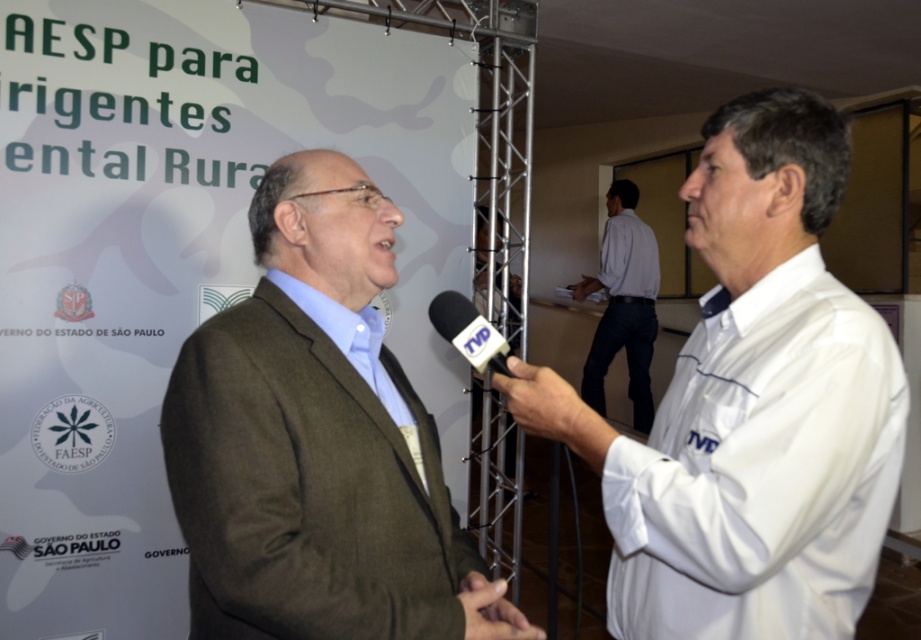
Question: Which object is the farthest from the white shirt at center?

Choices:
 (A) matte brown suit at center
 (B) black plastic microphone at center
 (C) white glossy shirt at center

Answer: (A)

Question: Can you confirm if matte brown suit at center is thinner than black plastic microphone at center?

Choices:
 (A) no
 (B) yes

Answer: (A)

Question: Which point is closer to the camera?

Choices:
 (A) (646, 358)
 (B) (366, 413)

Answer: (B)

Question: Is matte brown suit at center positioned before black plastic microphone at center?

Choices:
 (A) no
 (B) yes

Answer: (B)

Question: Does white glossy shirt at center appear on the right side of white shirt at center?

Choices:
 (A) yes
 (B) no

Answer: (B)

Question: Estimate the real-world distances between objects in this image. Which object is closer to the matte brown suit at center?

Choices:
 (A) white shirt at center
 (B) white glossy shirt at center

Answer: (B)